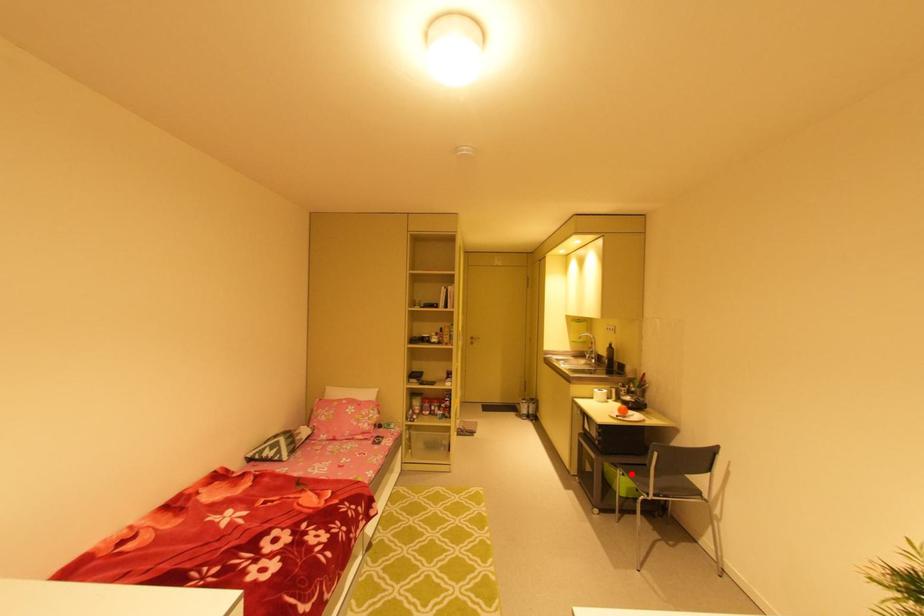
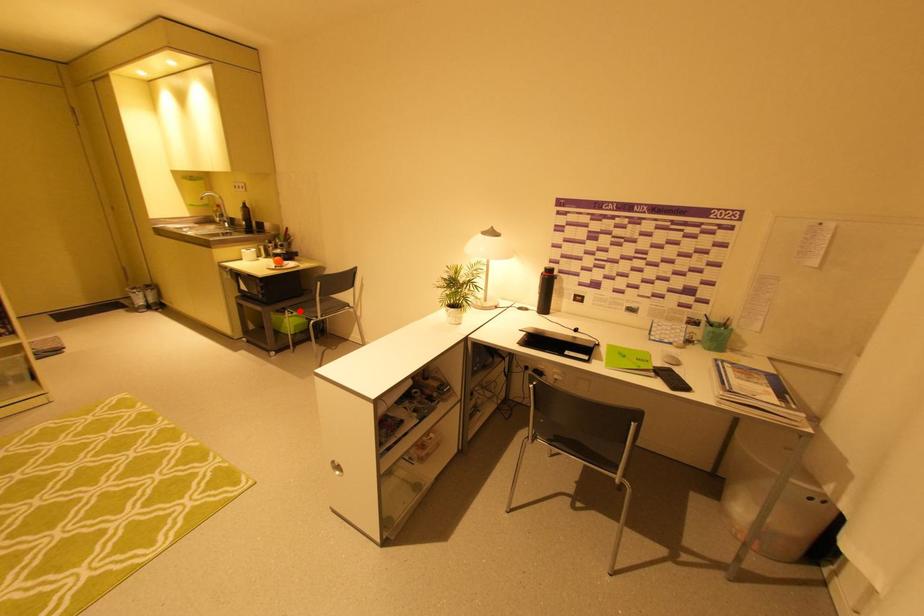
I am providing you with two images of the same scene from different viewpoints. A red point is marked on the first image and another point is marked on the second image. Is the red point in image1 aligned with the point shown in image2?

Yes